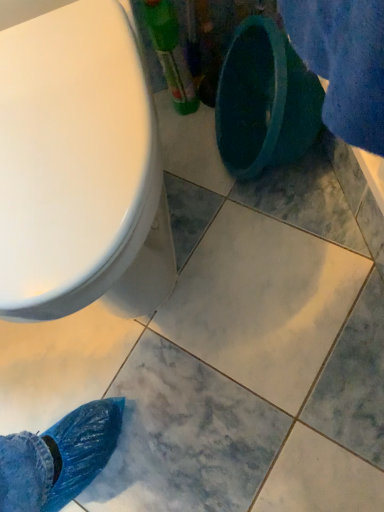
What do you see at coordinates (80, 169) in the screenshot?
I see `white glossy toilet at upper left` at bounding box center [80, 169].

In order to face white glossy toilet at upper left, should I rotate leftwards or rightwards?

To align with it, rotate left about 18.064°.

This screenshot has width=384, height=512. Identify the location of white glossy toilet at upper left. (80, 169).

Find the location of a particular element. white glossy toilet at upper left is located at coordinates (80, 169).